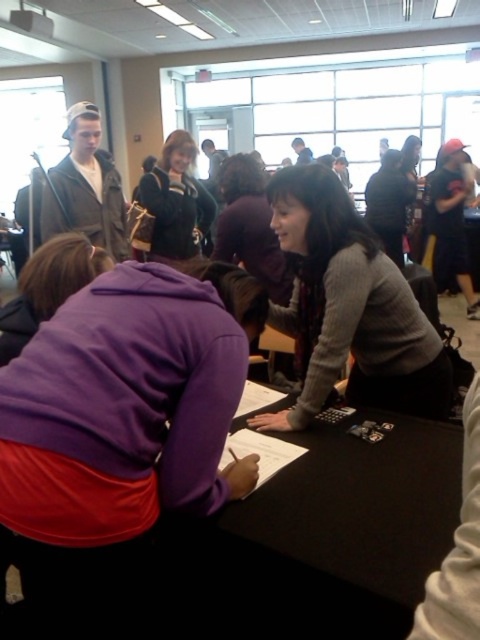
You are standing in the room and want to reach the point marked as point (288, 493). If you can move forward 1.1 meters, will you be able to reach that point?

The distance between you and point (288, 493) is 1.19 meters. Since you can move forward only 1.1 meters, you will not be able to reach the point as the distance is greater than your movement capability.

You are standing at the point labeled point (261, 260) and want to move to the point labeled point (310, 410). Is the direction you need to move towards in front of you or behind you?

The point (310, 410) is in front of point (261, 260), so you need to move forward to reach it.

Consider the image. You are standing at the point marked as point (297, 540) in the image. You want to walk to the nearest exit, which is located at the far end of the room. Considering the two people seated at the table, which direction should you go to avoid walking between them?

Since the two people seated at the table are 1.04 meters apart, it is advisable to walk around them on either side to avoid the narrow space between them.